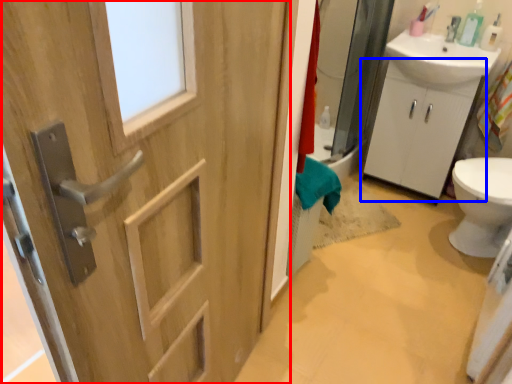
Question: Which object appears farthest to the camera in this image, door (highlighted by a red box) or bathroom cabinet (highlighted by a blue box)?

Choices:
 (A) door
 (B) bathroom cabinet

Answer: (B)